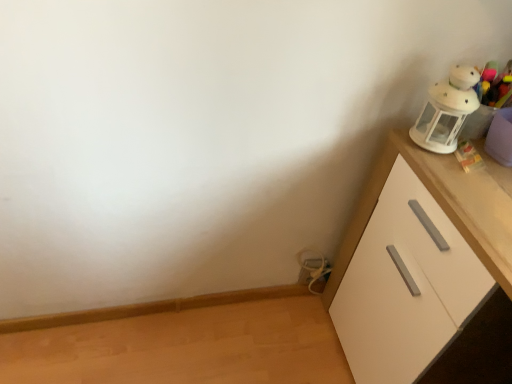
Question: Is white matte cabinet at right taller than white plush toy at upper right, the second toy viewed from the back?

Choices:
 (A) yes
 (B) no

Answer: (A)

Question: Can you confirm if white matte cabinet at right is positioned to the left of white plush toy at upper right, acting as the first toy starting from the front?

Choices:
 (A) yes
 (B) no

Answer: (B)

Question: Is white matte cabinet at right located outside white plush toy at upper right, acting as the first toy starting from the front?

Choices:
 (A) no
 (B) yes

Answer: (B)

Question: Can you confirm if white matte cabinet at right is bigger than white plush toy at upper right, which is the second toy in bottom-to-top order?

Choices:
 (A) yes
 (B) no

Answer: (A)

Question: From a real-world perspective, is white matte cabinet at right positioned under white plush toy at upper right, acting as the first toy starting from the front, based on gravity?

Choices:
 (A) no
 (B) yes

Answer: (B)

Question: From their relative heights in the image, would you say metallic silver cable at lower center, placed as the second toy when sorted from top to bottom, is taller or shorter than white plush toy at upper right, which is the second toy in bottom-to-top order?

Choices:
 (A) short
 (B) tall

Answer: (A)

Question: Is point (313, 259) positioned closer to the camera than point (435, 104)?

Choices:
 (A) closer
 (B) farther

Answer: (B)

Question: Based on their sizes in the image, would you say metallic silver cable at lower center, which is the second toy in right-to-left order, is bigger or smaller than white plush toy at upper right, acting as the first toy starting from the front?

Choices:
 (A) small
 (B) big

Answer: (A)

Question: Relative to white plush toy at upper right, which is the second toy in bottom-to-top order, is metallic silver cable at lower center, which ranks as the first toy in bottom-to-top order, in front or behind?

Choices:
 (A) behind
 (B) front

Answer: (A)

Question: In the image, is white matte cabinet at right on the left side or the right side of metallic silver cable at lower center, placed as the second toy when sorted from top to bottom?

Choices:
 (A) left
 (B) right

Answer: (B)

Question: From a real-world perspective, relative to metallic silver cable at lower center, acting as the 1th toy starting from the left, is white matte cabinet at right vertically above or below?

Choices:
 (A) above
 (B) below

Answer: (A)

Question: In terms of width, does white matte cabinet at right look wider or thinner when compared to metallic silver cable at lower center, acting as the 1th toy starting from the left?

Choices:
 (A) wide
 (B) thin

Answer: (A)

Question: Is white matte cabinet at right inside the boundaries of metallic silver cable at lower center, which ranks as the 2th toy in front-to-back order, or outside?

Choices:
 (A) inside
 (B) outside

Answer: (B)

Question: Considering the positions of white plush toy at upper right, which is counted as the second toy, starting from the left, and white matte cabinet at right in the image, is white plush toy at upper right, which is counted as the second toy, starting from the left, wider or thinner than white matte cabinet at right?

Choices:
 (A) thin
 (B) wide

Answer: (A)

Question: Would you say white plush toy at upper right, which is the second toy in bottom-to-top order, is to the left or to the right of white matte cabinet at right in the picture?

Choices:
 (A) left
 (B) right

Answer: (A)